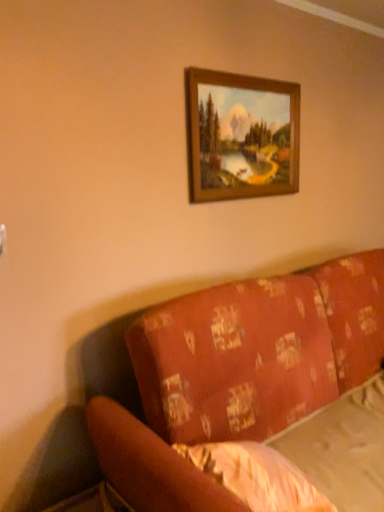
This screenshot has width=384, height=512. Find the location of `white textured sheet at lower right`. white textured sheet at lower right is located at coordinates (257, 476).

What do you see at coordinates (257, 476) in the screenshot? I see `white textured sheet at lower right` at bounding box center [257, 476].

Locate an element on the screen. The width and height of the screenshot is (384, 512). patterned fabric couch at lower right is located at coordinates (233, 375).

Where is `white textured sheet at lower right`? The height and width of the screenshot is (512, 384). white textured sheet at lower right is located at coordinates (257, 476).

Locate an element on the screen. picture frame behind the white textured sheet at lower right is located at coordinates (240, 136).

Which object is closer to the camera taking this photo, wooden frame at upper center or white textured sheet at lower right?

white textured sheet at lower right is in front.

Can you confirm if wooden frame at upper center is bigger than white textured sheet at lower right?

Actually, wooden frame at upper center might be smaller than white textured sheet at lower right.

Is point (225, 179) closer to camera compared to point (253, 477)?

No, it is behind (253, 477).

What's the angular difference between wooden frame at upper center and patterned fabric couch at lower right's facing directions?

The angle between the facing direction of wooden frame at upper center and the facing direction of patterned fabric couch at lower right is 0.000616 degrees.

How far apart are wooden frame at upper center and patterned fabric couch at lower right?

wooden frame at upper center and patterned fabric couch at lower right are 32.37 inches apart.

From the picture: From the image's perspective, is wooden frame at upper center above patterned fabric couch at lower right?

Yes, from the image's perspective, wooden frame at upper center is on top of patterned fabric couch at lower right.

Is wooden frame at upper center not within patterned fabric couch at lower right?

Absolutely, wooden frame at upper center is external to patterned fabric couch at lower right.

From the image's perspective, is patterned fabric couch at lower right on top of white textured sheet at lower right?

Yes, from the image's perspective, patterned fabric couch at lower right is over white textured sheet at lower right.

In the image, is patterned fabric couch at lower right on the left side or the right side of white textured sheet at lower right?

Clearly, patterned fabric couch at lower right is on the right of white textured sheet at lower right in the image.

Considering the sizes of objects patterned fabric couch at lower right and white textured sheet at lower right in the image provided, who is smaller, patterned fabric couch at lower right or white textured sheet at lower right?

With smaller size is white textured sheet at lower right.

Is white textured sheet at lower right a part of patterned fabric couch at lower right?

Yes, white textured sheet at lower right is a part of patterned fabric couch at lower right.

From the image's perspective, is white textured sheet at lower right under patterned fabric couch at lower right?

Indeed, from the image's perspective, white textured sheet at lower right is shown beneath patterned fabric couch at lower right.

Does white textured sheet at lower right touch patterned fabric couch at lower right?

No, white textured sheet at lower right is not in contact with patterned fabric couch at lower right.

In the scene shown: Visually, is patterned fabric couch at lower right positioned to the left or to the right of wooden frame at upper center?

In the image, patterned fabric couch at lower right appears on the right side of wooden frame at upper center.

Is patterned fabric couch at lower right positioned beyond the bounds of wooden frame at upper center?

Yes, patterned fabric couch at lower right is located beyond the bounds of wooden frame at upper center.

Locate an element on the screen. The height and width of the screenshot is (512, 384). studio couch located below the wooden frame at upper center (from the image's perspective) is located at coordinates (233, 375).

Between point (346, 331) and point (205, 127), which one is positioned behind?

The point (346, 331) is behind.

Could wooden frame at upper center be considered to be inside white textured sheet at lower right?

No.

Looking at this image, which is less distant, (202, 455) or (190, 123)?

Point (202, 455) appears to be closer to the viewer than point (190, 123).

Considering the relative sizes of white textured sheet at lower right and wooden frame at upper center in the image provided, is white textured sheet at lower right taller than wooden frame at upper center?

No.

How many degrees apart are the facing directions of white textured sheet at lower right and wooden frame at upper center?

The angular difference between white textured sheet at lower right and wooden frame at upper center is 7.24 degrees.

Locate an element on the screen. Image resolution: width=384 pixels, height=512 pixels. sheet below the wooden frame at upper center (from a real-world perspective) is located at coordinates coord(257,476).

At what (x,y) coordinates should I click in order to perform the action: click on studio couch in front of the wooden frame at upper center. Please return your answer as a coordinate pair (x, y). Looking at the image, I should click on (233, 375).

When comparing their distances from white textured sheet at lower right, does patterned fabric couch at lower right or wooden frame at upper center seem further?

wooden frame at upper center.

Estimate the real-world distances between objects in this image. Which object is further from patterned fabric couch at lower right, wooden frame at upper center or white textured sheet at lower right?

wooden frame at upper center is further to patterned fabric couch at lower right.

When comparing their distances from patterned fabric couch at lower right, does white textured sheet at lower right or wooden frame at upper center seem closer?

white textured sheet at lower right is positioned closer to the anchor patterned fabric couch at lower right.

Based on their spatial positions, is white textured sheet at lower right or patterned fabric couch at lower right closer to wooden frame at upper center?

patterned fabric couch at lower right is positioned closer to the anchor wooden frame at upper center.

Which object lies nearer to the anchor point white textured sheet at lower right, wooden frame at upper center or patterned fabric couch at lower right?

patterned fabric couch at lower right is closer to white textured sheet at lower right.

Estimate the real-world distances between objects in this image. Which object is closer to wooden frame at upper center, patterned fabric couch at lower right or white textured sheet at lower right?

patterned fabric couch at lower right lies closer to wooden frame at upper center than the other object.

Where is `studio couch between wooden frame at upper center and white textured sheet at lower right in the up-down direction`? This screenshot has width=384, height=512. studio couch between wooden frame at upper center and white textured sheet at lower right in the up-down direction is located at coordinates (233, 375).